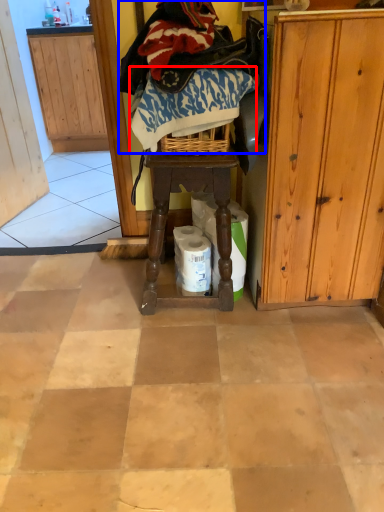
Question: Which object appears closest to the camera in this image, clothing (highlighted by a red box) or clothing (highlighted by a blue box)?

Choices:
 (A) clothing
 (B) clothing

Answer: (B)